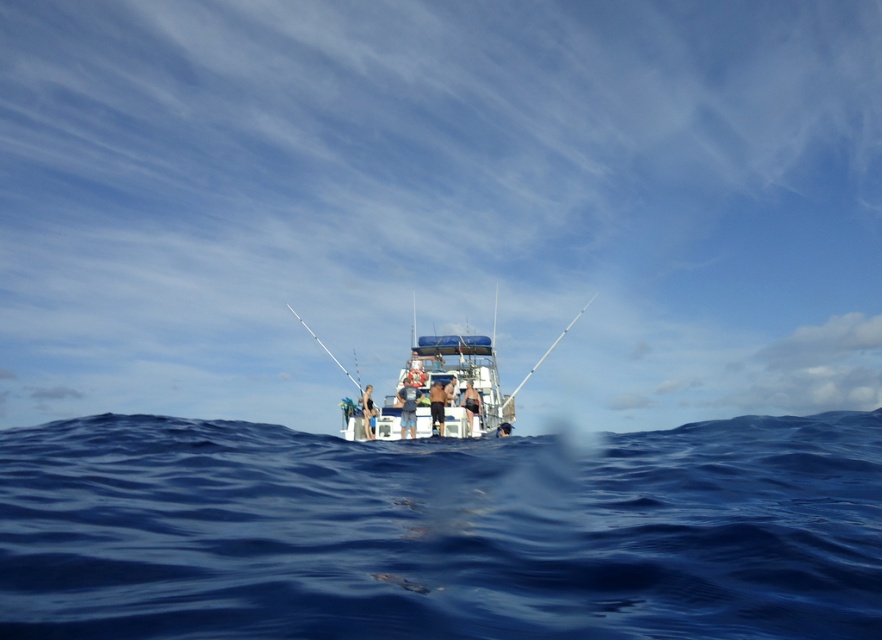
Who is taller, deep blue water at center or white fiberglass fishing pole at center?

white fiberglass fishing pole at center is taller.

Does deep blue water at center appear over white fiberglass fishing pole at center?

Actually, deep blue water at center is below white fiberglass fishing pole at center.

Locate an element on the screen. The width and height of the screenshot is (882, 640). deep blue water at center is located at coordinates (441, 531).